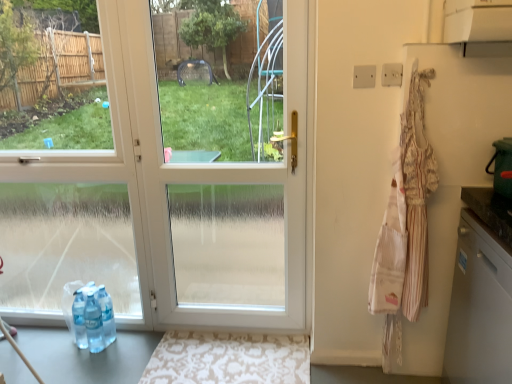
Question: Is white glossy door at center not within white glossy dishwasher at right?

Choices:
 (A) no
 (B) yes

Answer: (B)

Question: Is white glossy door at center wider than white glossy dishwasher at right?

Choices:
 (A) yes
 (B) no

Answer: (B)

Question: From the image's perspective, is white glossy door at center beneath white glossy dishwasher at right?

Choices:
 (A) no
 (B) yes

Answer: (A)

Question: Is white glossy door at center surrounding white glossy dishwasher at right?

Choices:
 (A) yes
 (B) no

Answer: (B)

Question: Are white glossy door at center and white glossy dishwasher at right beside each other?

Choices:
 (A) yes
 (B) no

Answer: (B)

Question: Considering the relative positions of white glossy door at center and white glossy dishwasher at right in the image provided, is white glossy door at center to the right of white glossy dishwasher at right from the viewer's perspective?

Choices:
 (A) no
 (B) yes

Answer: (A)

Question: Is striped cotton apron at right located within beige damask rug at lower center?

Choices:
 (A) yes
 (B) no

Answer: (B)

Question: From the image's perspective, would you say beige damask rug at lower center is positioned over striped cotton apron at right?

Choices:
 (A) yes
 (B) no

Answer: (B)

Question: Does beige damask rug at lower center have a lesser width compared to striped cotton apron at right?

Choices:
 (A) yes
 (B) no

Answer: (B)

Question: From a real-world perspective, is beige damask rug at lower center positioned under striped cotton apron at right based on gravity?

Choices:
 (A) yes
 (B) no

Answer: (A)

Question: Is beige damask rug at lower center next to striped cotton apron at right?

Choices:
 (A) yes
 (B) no

Answer: (B)

Question: Is beige damask rug at lower center outside of striped cotton apron at right?

Choices:
 (A) no
 (B) yes

Answer: (B)

Question: Does striped cotton apron at right turn towards white glossy door at center?

Choices:
 (A) no
 (B) yes

Answer: (A)